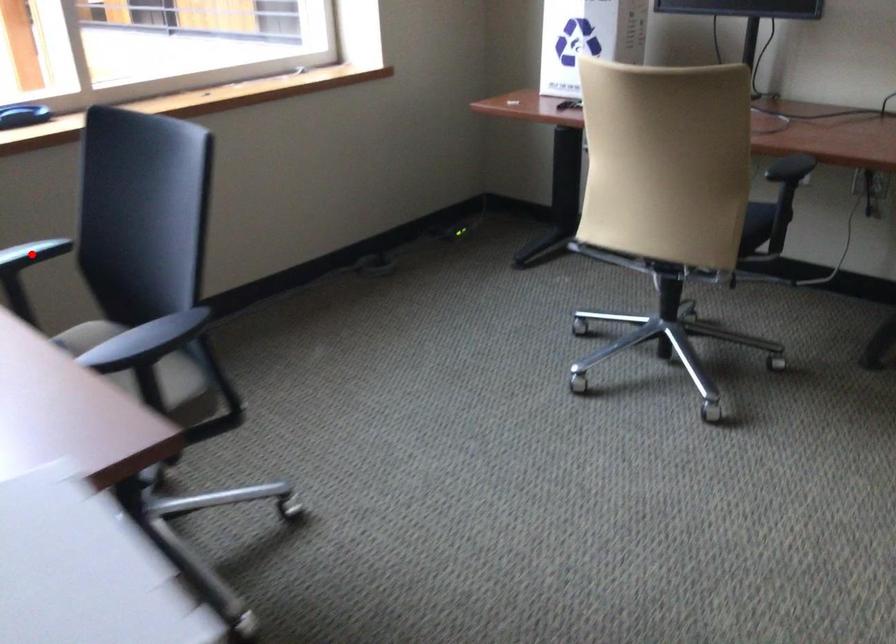
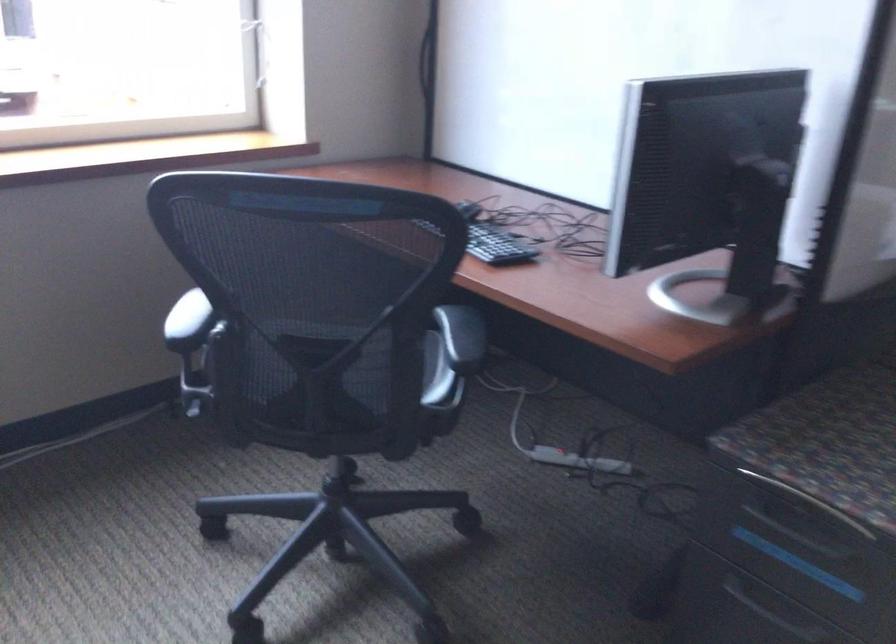
Question: I am providing you with two images of the same scene from different viewpoints. A red point is marked on the first image. Is the red point's position out of view in image 2?

Choices:
 (A) Yes
 (B) No

Answer: (A)